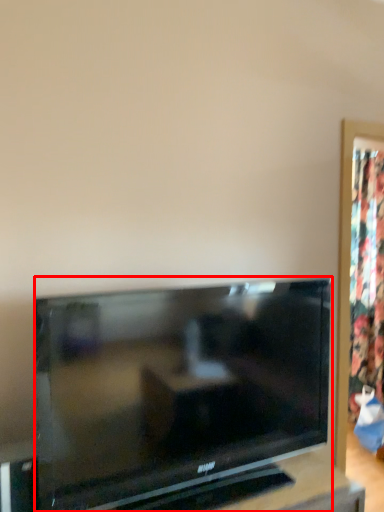
Question: In this image, where is television (annotated by the red box) located relative to curtain?

Choices:
 (A) right
 (B) left

Answer: (B)